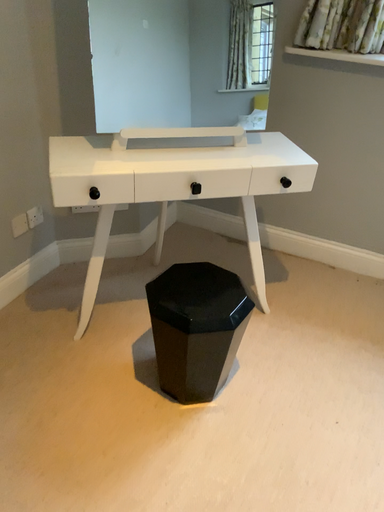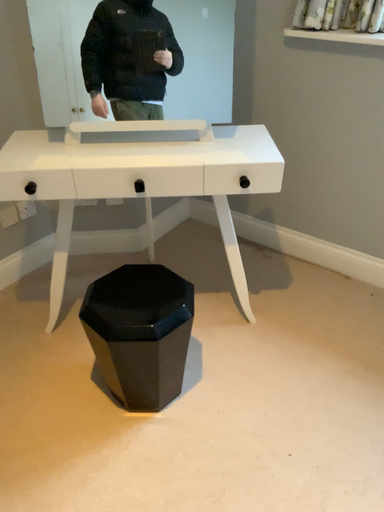
Question: How did the camera likely rotate when shooting the video?

Choices:
 (A) rotated right
 (B) rotated left

Answer: (B)